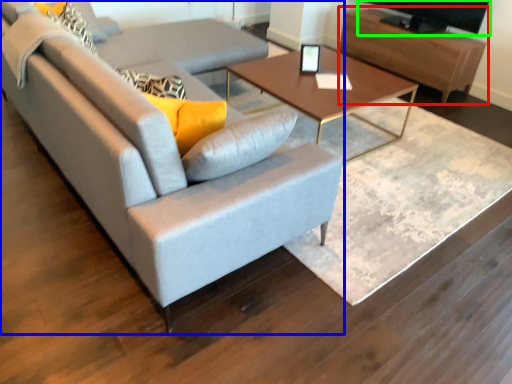
Question: Based on their relative distances, which object is farther from entertainment center (highlighted by a red box)? Choose from studio couch (highlighted by a blue box) and television (highlighted by a green box).

Choices:
 (A) studio couch
 (B) television

Answer: (A)